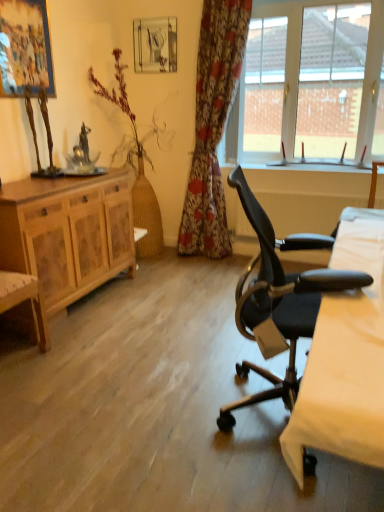
Question: Is white glass window at upper right next to black leather office chair at right?

Choices:
 (A) yes
 (B) no

Answer: (B)

Question: Considering the relative sizes of white glass window at upper right and black leather office chair at right in the image provided, is white glass window at upper right bigger than black leather office chair at right?

Choices:
 (A) no
 (B) yes

Answer: (A)

Question: Considering the relative positions of white glass window at upper right and black leather office chair at right in the image provided, is white glass window at upper right to the left of black leather office chair at right from the viewer's perspective?

Choices:
 (A) yes
 (B) no

Answer: (B)

Question: From a real-world perspective, does white glass window at upper right sit lower than black leather office chair at right?

Choices:
 (A) yes
 (B) no

Answer: (B)

Question: From the image's perspective, is white glass window at upper right on top of black leather office chair at right?

Choices:
 (A) yes
 (B) no

Answer: (A)

Question: Can you confirm if white glass window at upper right is thinner than black leather office chair at right?

Choices:
 (A) no
 (B) yes

Answer: (B)

Question: Is white glass window at upper right a part of wooden cabinet at left?

Choices:
 (A) no
 (B) yes

Answer: (A)

Question: Is wooden cabinet at left not within white glass window at upper right?

Choices:
 (A) yes
 (B) no

Answer: (A)

Question: Is wooden cabinet at left in front of white glass window at upper right?

Choices:
 (A) yes
 (B) no

Answer: (A)

Question: Considering the relative sizes of wooden cabinet at left and white glass window at upper right in the image provided, is wooden cabinet at left shorter than white glass window at upper right?

Choices:
 (A) yes
 (B) no

Answer: (A)

Question: Is wooden cabinet at left aimed at white glass window at upper right?

Choices:
 (A) yes
 (B) no

Answer: (B)

Question: From the image's perspective, does wooden cabinet at left appear higher than white glass window at upper right?

Choices:
 (A) no
 (B) yes

Answer: (A)

Question: Would you say floral fabric curtain at center is part of bare wood vase at left's contents?

Choices:
 (A) yes
 (B) no

Answer: (B)